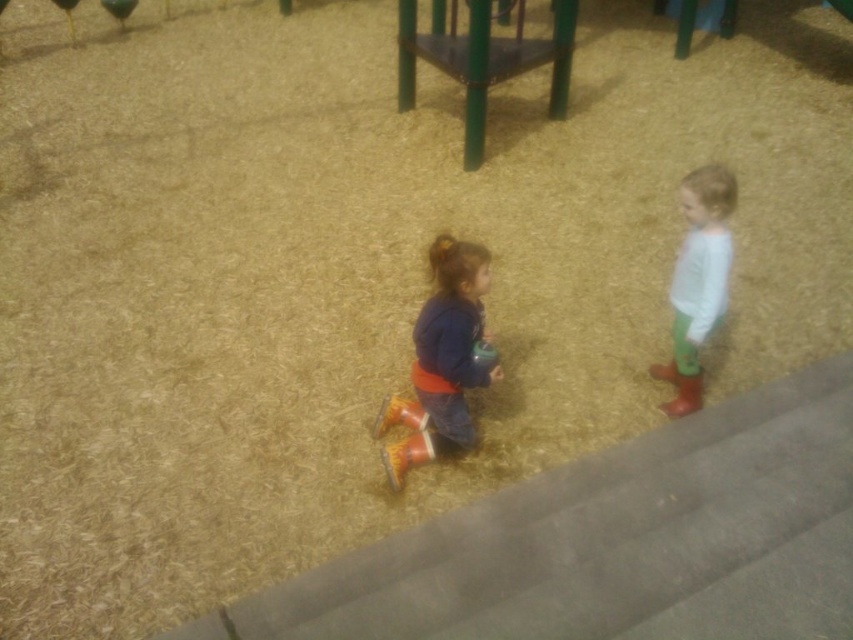
Can you confirm if matte orange boots at center is positioned to the left of white matte shirt at right?

Yes, matte orange boots at center is to the left of white matte shirt at right.

Looking at this image, does matte orange boots at center have a smaller size compared to white matte shirt at right?

Actually, matte orange boots at center might be larger than white matte shirt at right.

Identify the location of matte orange boots at center. (442, 360).